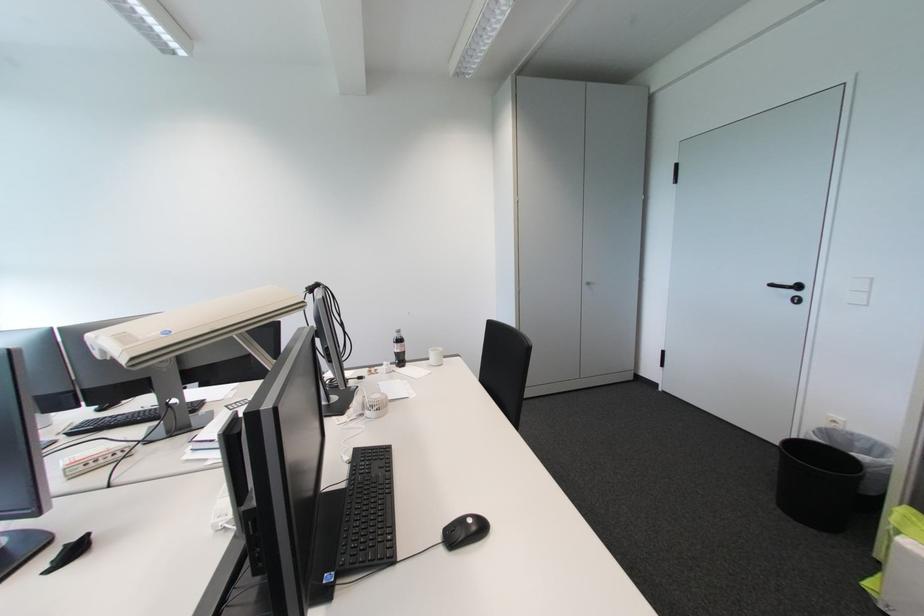
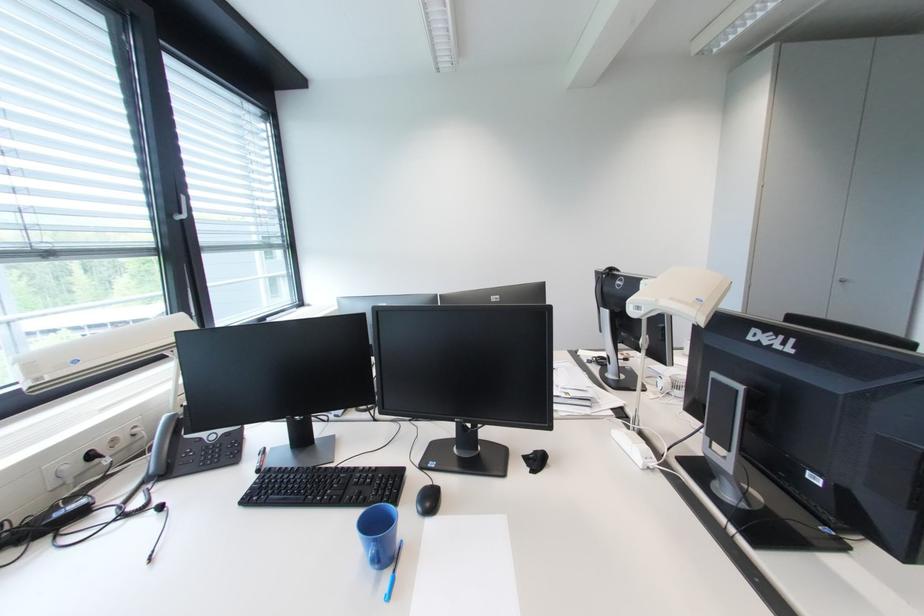
Where in the second image is the point corresponding to [591,286] from the first image?

(844, 285)